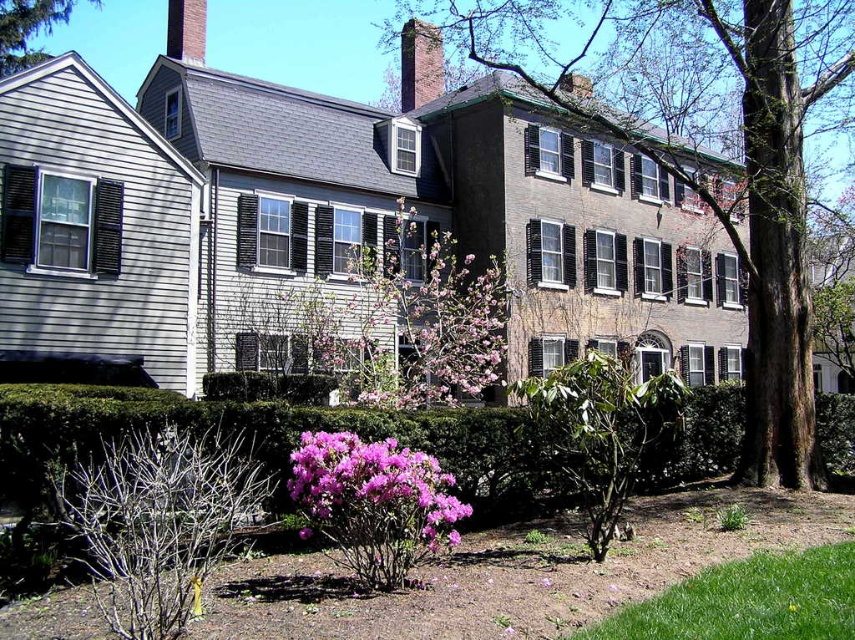
Can you confirm if bare branches at lower left is positioned above purple matte flower at center?

Incorrect, bare branches at lower left is not positioned above purple matte flower at center.

Who is shorter, bare branches at lower left or purple matte flower at center?

Standing shorter between the two is purple matte flower at center.

Locate an element on the screen. bare branches at lower left is located at coordinates (158, 522).

Find the location of a particular element. bare branches at lower left is located at coordinates (158, 522).

Which of these two, green leafy hedge at lower center or pink bloom at center, stands shorter?

Standing shorter between the two is green leafy hedge at lower center.

Does green leafy hedge at lower center lie in front of pink bloom at center?

That is True.

Between point (81, 452) and point (358, 253), which one is positioned in front?

Positioned in front is point (81, 452).

Locate an element on the screen. This screenshot has width=855, height=640. green leafy hedge at lower center is located at coordinates (270, 436).

Who is more distant from viewer, (62, 492) or (9, 22)?

Point (9, 22)

You are a GUI agent. You are given a task and a screenshot of the screen. Output one action in this format:
    pyautogui.click(x=<x>, y=<y>)
    Task: Click on the bare branches at lower left
    The width and height of the screenshot is (855, 640).
    Given the screenshot: What is the action you would take?
    pyautogui.click(x=158, y=522)

Find the location of `bare branches at lower left`. bare branches at lower left is located at coordinates (158, 522).